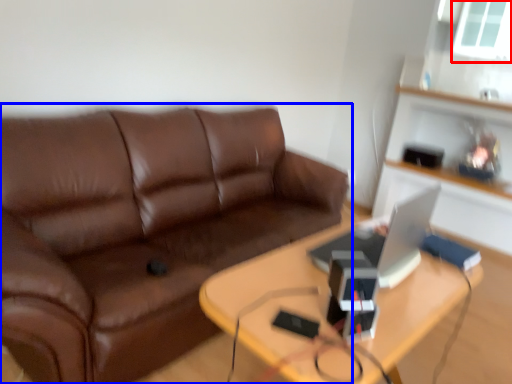
Question: Which object is closer to the camera taking this photo, window screen (highlighted by a red box) or studio couch (highlighted by a blue box)?

Choices:
 (A) window screen
 (B) studio couch

Answer: (B)